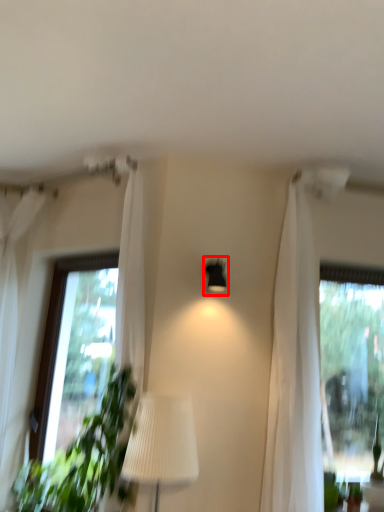
Question: From the image's perspective, considering the relative positions of lamp (annotated by the red box) and curtain in the image provided, where is lamp (annotated by the red box) located with respect to the staircase?

Choices:
 (A) above
 (B) below

Answer: (A)